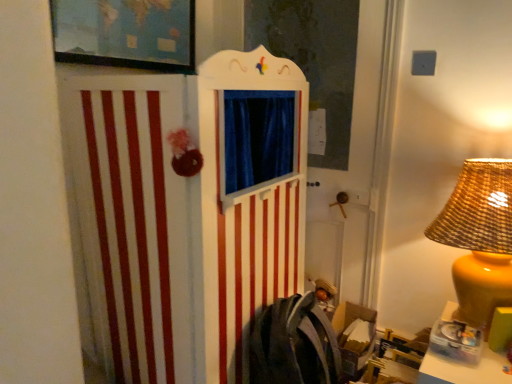
Question: From the image's perspective, is translucent plastic container at lower right located beneath matte yellow lampshade at right?

Choices:
 (A) yes
 (B) no

Answer: (A)

Question: Considering the relative positions of translucent plastic container at lower right and matte yellow lampshade at right in the image provided, is translucent plastic container at lower right to the left of matte yellow lampshade at right from the viewer's perspective?

Choices:
 (A) yes
 (B) no

Answer: (B)

Question: From a real-world perspective, is translucent plastic container at lower right beneath matte yellow lampshade at right?

Choices:
 (A) no
 (B) yes

Answer: (B)

Question: Is matte yellow lampshade at right surrounded by translucent plastic container at lower right?

Choices:
 (A) yes
 (B) no

Answer: (B)

Question: From the image's perspective, is translucent plastic container at lower right above matte yellow lampshade at right?

Choices:
 (A) yes
 (B) no

Answer: (B)

Question: From a real-world perspective, is matte black picture frame at upper left physically located above or below matte yellow lampshade at right?

Choices:
 (A) above
 (B) below

Answer: (A)

Question: Which is correct: matte black picture frame at upper left is inside matte yellow lampshade at right, or outside of it?

Choices:
 (A) outside
 (B) inside

Answer: (A)

Question: In terms of width, does matte black picture frame at upper left look wider or thinner when compared to matte yellow lampshade at right?

Choices:
 (A) thin
 (B) wide

Answer: (A)

Question: Based on their sizes in the image, would you say matte black picture frame at upper left is bigger or smaller than matte yellow lampshade at right?

Choices:
 (A) big
 (B) small

Answer: (B)

Question: In terms of size, does translucent plastic container at lower right appear bigger or smaller than matte black picture frame at upper left?

Choices:
 (A) big
 (B) small

Answer: (A)

Question: Would you say translucent plastic container at lower right is inside or outside matte black picture frame at upper left?

Choices:
 (A) inside
 (B) outside

Answer: (B)

Question: From the image's perspective, is translucent plastic container at lower right positioned above or below matte black picture frame at upper left?

Choices:
 (A) above
 (B) below

Answer: (B)

Question: Is translucent plastic container at lower right in front of or behind matte black picture frame at upper left in the image?

Choices:
 (A) behind
 (B) front

Answer: (B)

Question: Choose the correct answer: Is translucent plastic container at lower right inside matte yellow lampshade at right or outside it?

Choices:
 (A) inside
 (B) outside

Answer: (B)

Question: Considering the relative positions of translucent plastic container at lower right and matte yellow lampshade at right in the image provided, is translucent plastic container at lower right to the left or to the right of matte yellow lampshade at right?

Choices:
 (A) right
 (B) left

Answer: (A)